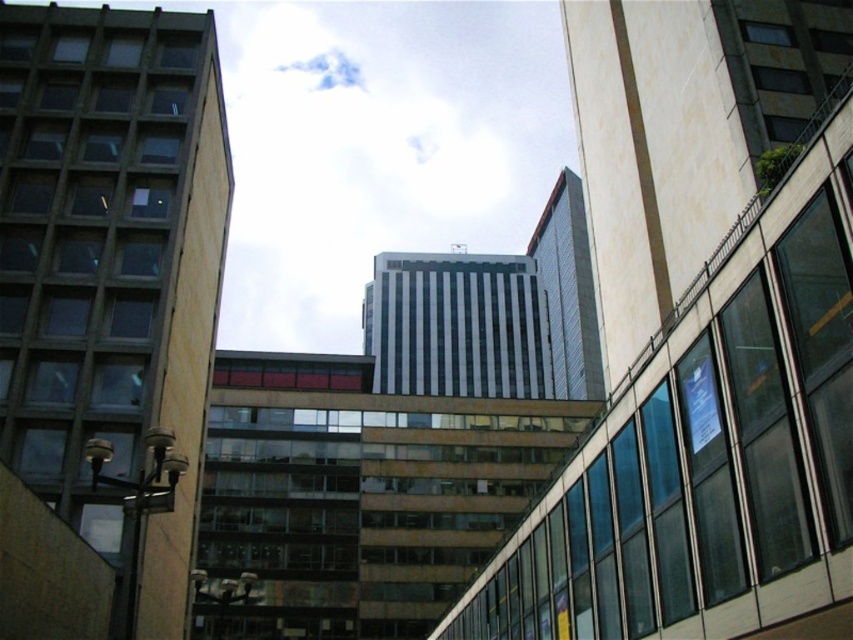
Can you confirm if glassy reflective building at center is bigger than matte concrete building at left?

Yes, glassy reflective building at center is bigger than matte concrete building at left.

Does glassy reflective building at center have a lesser width compared to matte concrete building at left?

No.

The image size is (853, 640). In order to click on glassy reflective building at center in this screenshot , I will do `click(701, 337)`.